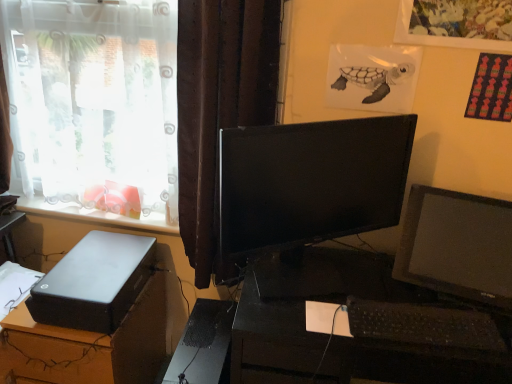
Find the location of a particular element. The height and width of the screenshot is (384, 512). free space above black matte computer tower at lower left (from a real-world perspective) is located at coordinates (201, 340).